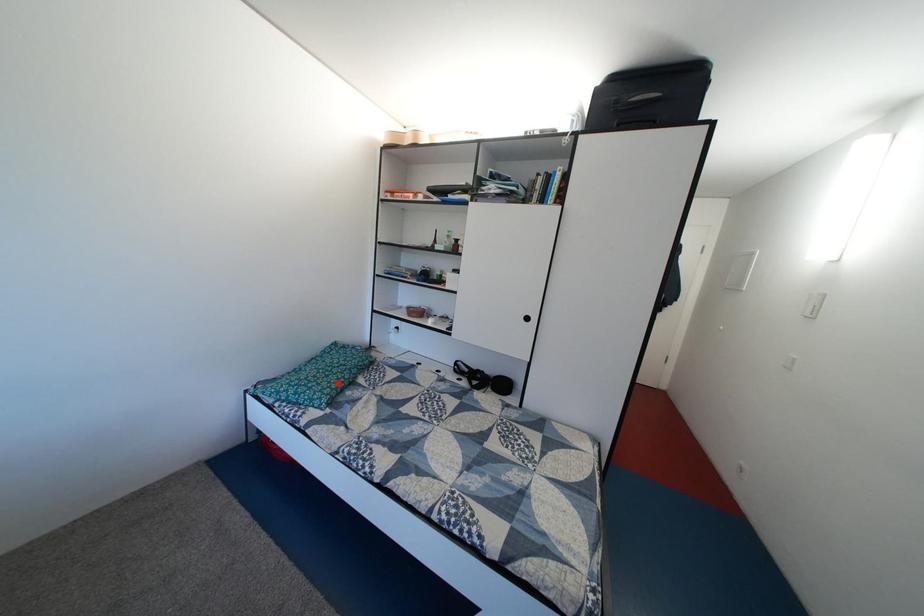
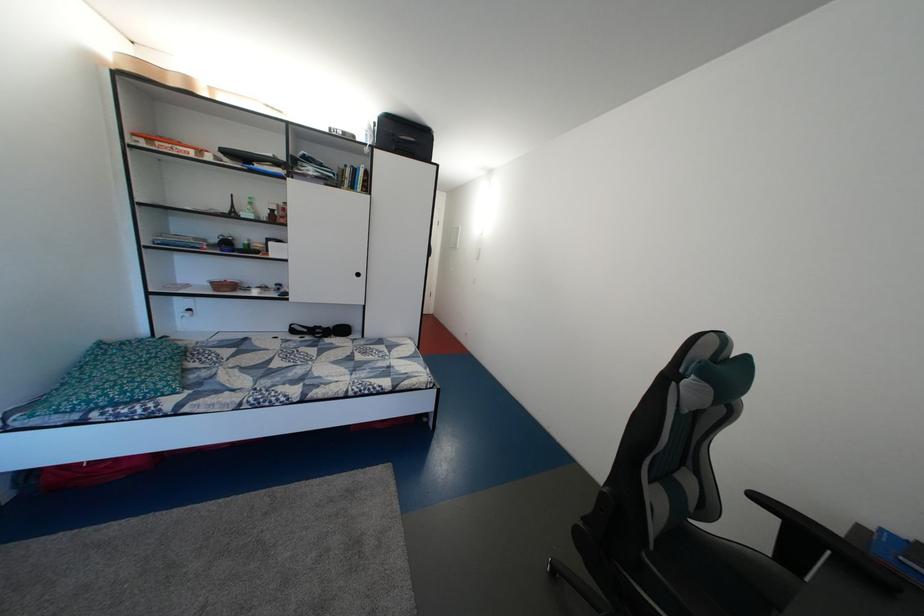
Question: I am providing you with two images of the same scene from different viewpoints. Given a red point in image1, look at the same physical point in image2. Is it:

Choices:
 (A) Closer to the viewpoint
 (B) Farther from the viewpoint

Answer: (B)